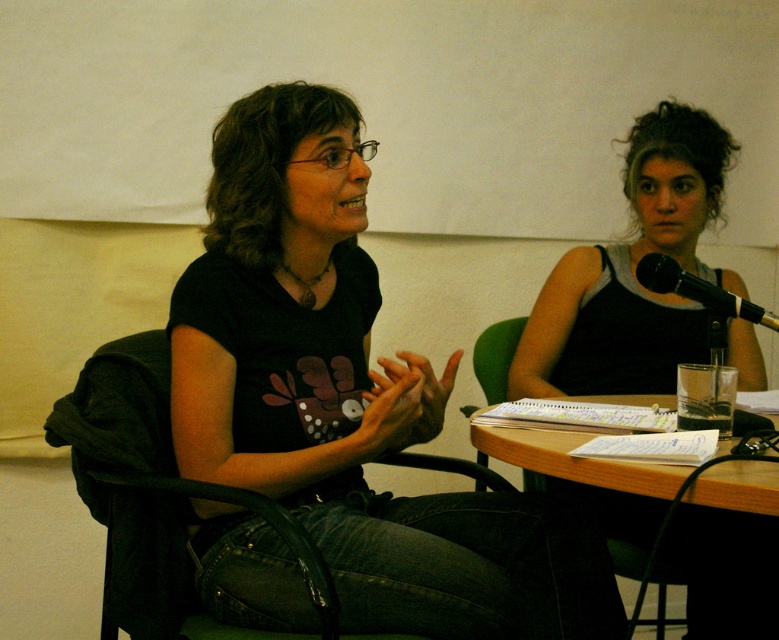
You are a delivery robot with a 30 inch wide package. You need to place the package between the black tank top at right and the black plastic chair at left. Is there enough space to fit the package there?

The distance between the black tank top at right and the black plastic chair at left is 32.88 inches. Since the package is 30 inches wide, there is enough space to fit it between them.

In the scene shown: You are a photographer trying to capture a portrait of both individuals. The black tank top at right and the black plastic chair at left are in the frame. Which object is taller in the image?

The black tank top at right is much taller than the black plastic chair at left according to the description.